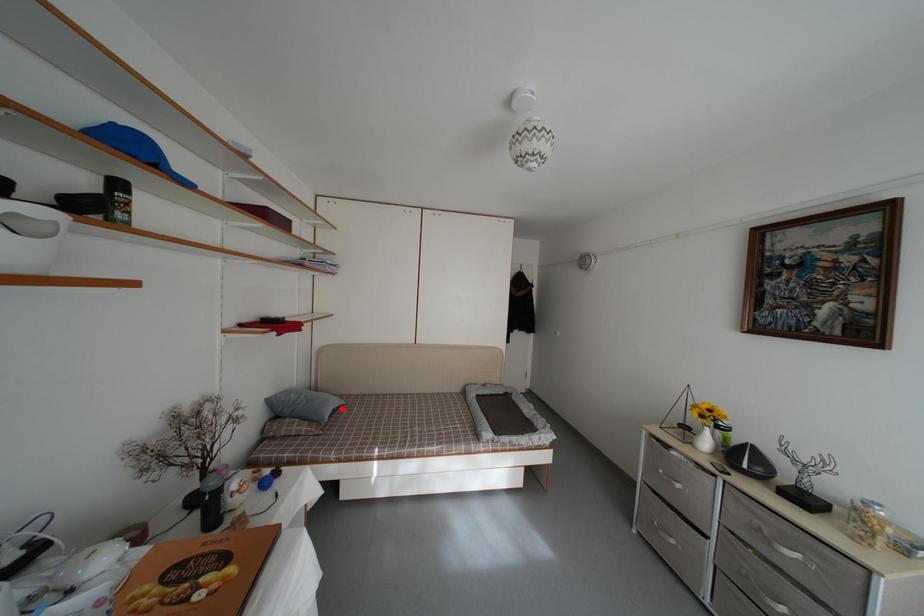
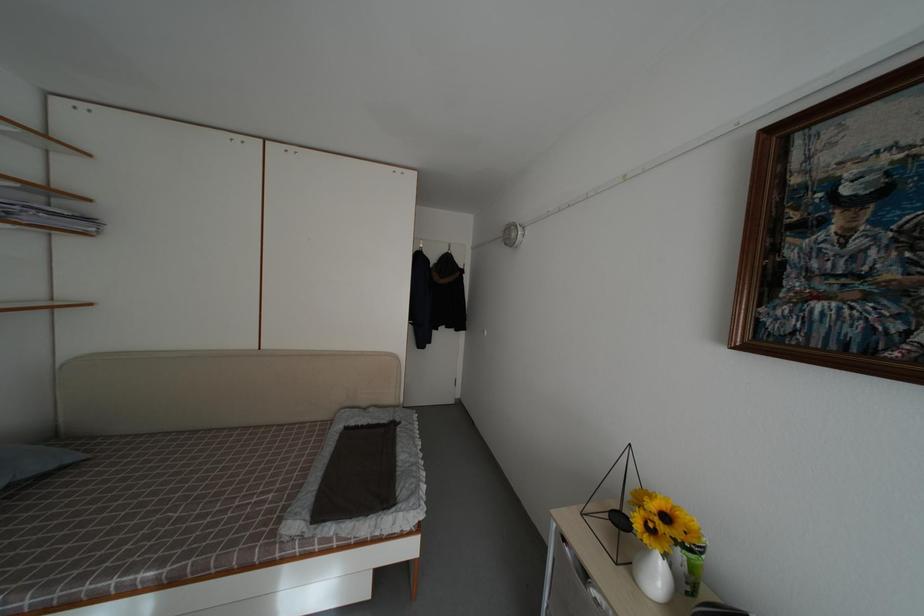
Find the pixel in the second image that matches the highlighted location in the first image.

(50, 469)